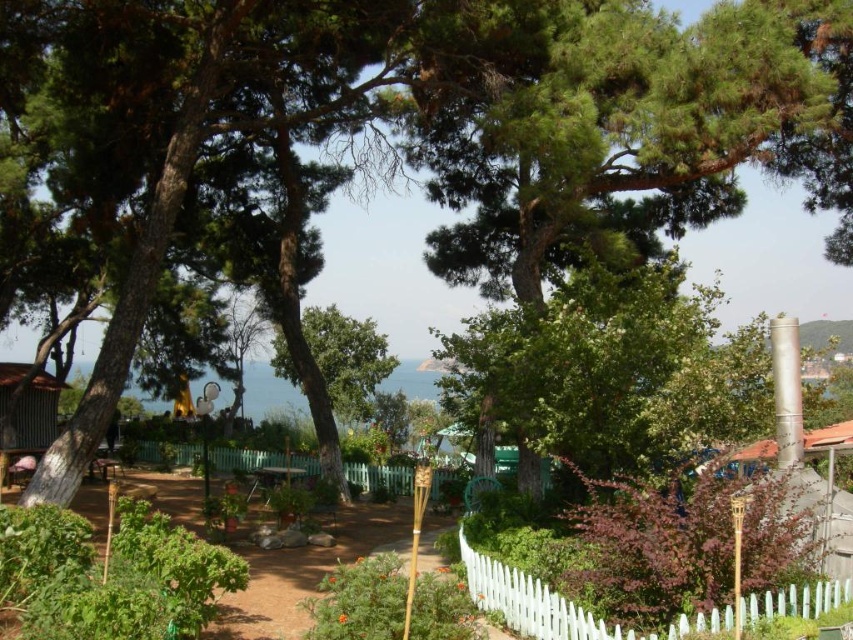
Based on the photo, between white picket fence at center and green matte tree at center, which one appears on the left side from the viewer's perspective?

Positioned to the left is green matte tree at center.

Does white picket fence at center appear on the left side of green matte tree at center?

In fact, white picket fence at center is to the right of green matte tree at center.

At what (x,y) coordinates should I click in order to perform the action: click on white picket fence at center. Please return your answer as a coordinate pair (x, y). Image resolution: width=853 pixels, height=640 pixels. Looking at the image, I should click on (558, 605).

Can you confirm if green leafy tree at center is thinner than green wooden fence at center?

Yes, green leafy tree at center is thinner than green wooden fence at center.

Can you confirm if green leafy tree at center is positioned above green wooden fence at center?

Yes.

Describe the element at coordinates (616, 371) in the screenshot. This screenshot has width=853, height=640. I see `green leafy tree at center` at that location.

Image resolution: width=853 pixels, height=640 pixels. Identify the location of green leafy tree at center. (616, 371).

Consider the image. Which of these two, wooden hut at right or green wooden fence at center, stands taller?

Standing taller between the two is wooden hut at right.

Between wooden hut at right and green wooden fence at center, which one appears on the right side from the viewer's perspective?

wooden hut at right

Which is behind, point (827, 513) or point (173, 448)?

Positioned behind is point (173, 448).

I want to click on wooden hut at right, so click(822, 497).